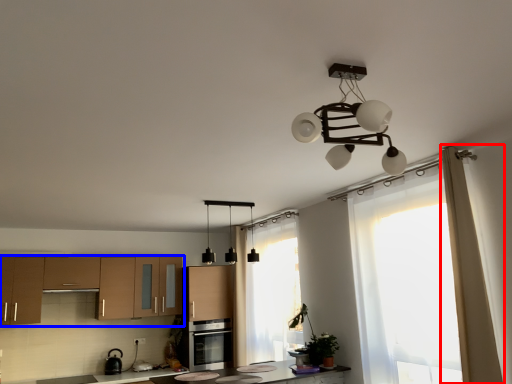
Question: Which object appears closest to the camera in this image, curtain (highlighted by a red box) or cabinetry (highlighted by a blue box)?

Choices:
 (A) curtain
 (B) cabinetry

Answer: (A)